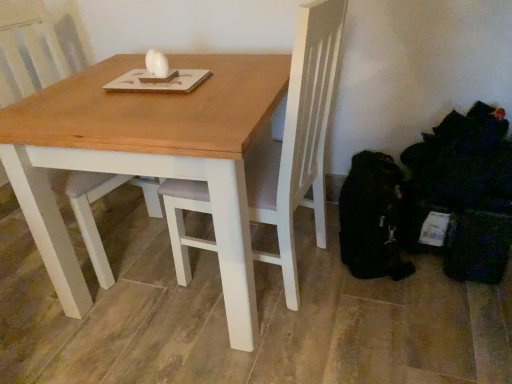
Question: Is point (245, 299) positioned closer to the camera than point (84, 210)?

Choices:
 (A) closer
 (B) farther

Answer: (A)

Question: Considering their positions, is wooden table at center located in front of or behind white wood chair at center?

Choices:
 (A) front
 (B) behind

Answer: (A)

Question: Is wooden table at center inside the boundaries of white wood chair at center, or outside?

Choices:
 (A) outside
 (B) inside

Answer: (A)

Question: From a real-world perspective, is white wood chair at center above or below wooden table at center?

Choices:
 (A) below
 (B) above

Answer: (B)

Question: In terms of height, does white wood chair at center look taller or shorter compared to wooden table at center?

Choices:
 (A) tall
 (B) short

Answer: (A)

Question: From the image's perspective, is white wood chair at center positioned above or below wooden table at center?

Choices:
 (A) above
 (B) below

Answer: (A)

Question: Do you think white wood chair at center is within wooden table at center, or outside of it?

Choices:
 (A) inside
 (B) outside

Answer: (A)